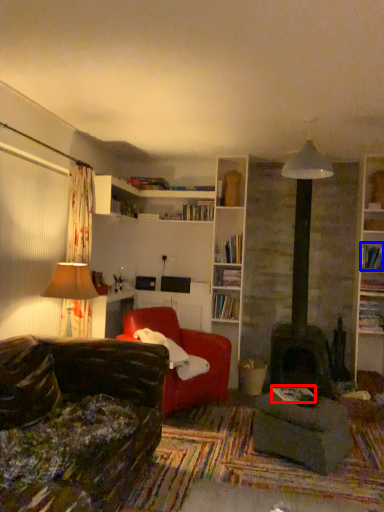
Question: Which object is closer to the camera taking this photo, book (highlighted by a red box) or book (highlighted by a blue box)?

Choices:
 (A) book
 (B) book

Answer: (A)